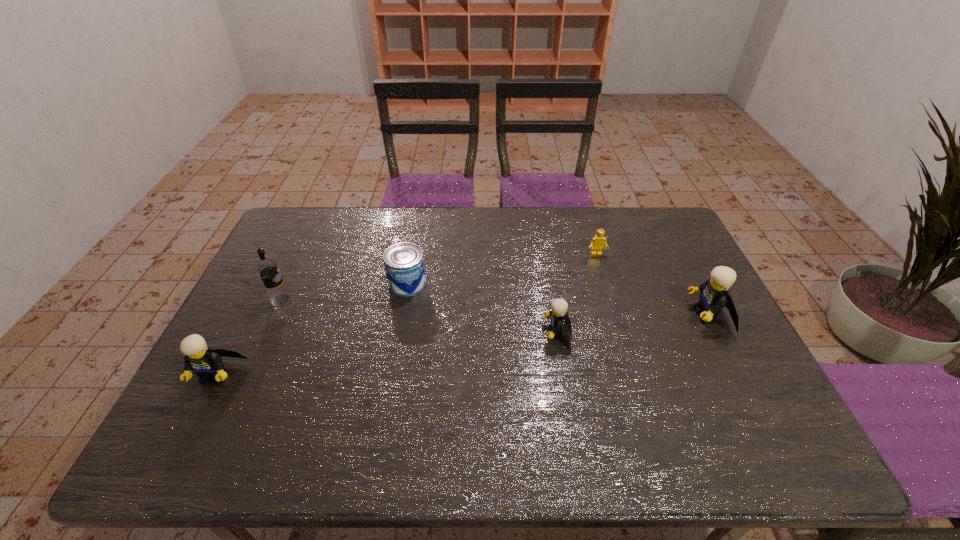
Locate an element on the screen. object that stands as the closest to the third object from right to left is located at coordinates (597, 243).

Identify which Lego is the third closest to the vodka. Please provide its 2D coordinates. Your answer should be formatted as a tuple, i.e. [(x, y)], where the tuple contains the x and y coordinates of a point satisfying the conditions above.

[(597, 243)]

The width and height of the screenshot is (960, 540). Find the location of `the second closest Lego to the second Lego from left to right`. the second closest Lego to the second Lego from left to right is located at coordinates (714, 296).

The height and width of the screenshot is (540, 960). I want to click on blank area in the image that satisfies the following two spatial constraints: 1. on the face of the shortest object; 2. on the label of the vodka, so click(x=611, y=300).

This screenshot has height=540, width=960. I want to click on free spot that satisfies the following two spatial constraints: 1. on the front-facing side of the third tallest Lego; 2. on the front-facing side of the nearest object, so click(x=564, y=375).

Image resolution: width=960 pixels, height=540 pixels. Identify the location of vacant region that satisfies the following two spatial constraints: 1. on the label of the vodka; 2. on the front-facing side of the nearest object. (247, 375).

At what (x,y) coordinates should I click in order to perform the action: click on vacant space that satisfies the following two spatial constraints: 1. on the label of the vodka; 2. on the front-facing side of the second tallest Lego. Please return your answer as a coordinate pair (x, y). Looking at the image, I should click on (247, 375).

The width and height of the screenshot is (960, 540). Find the location of `free spot that satisfies the following two spatial constraints: 1. on the front-facing side of the third object from right to left; 2. on the front-facing side of the third tallest object`. free spot that satisfies the following two spatial constraints: 1. on the front-facing side of the third object from right to left; 2. on the front-facing side of the third tallest object is located at coordinates (564, 375).